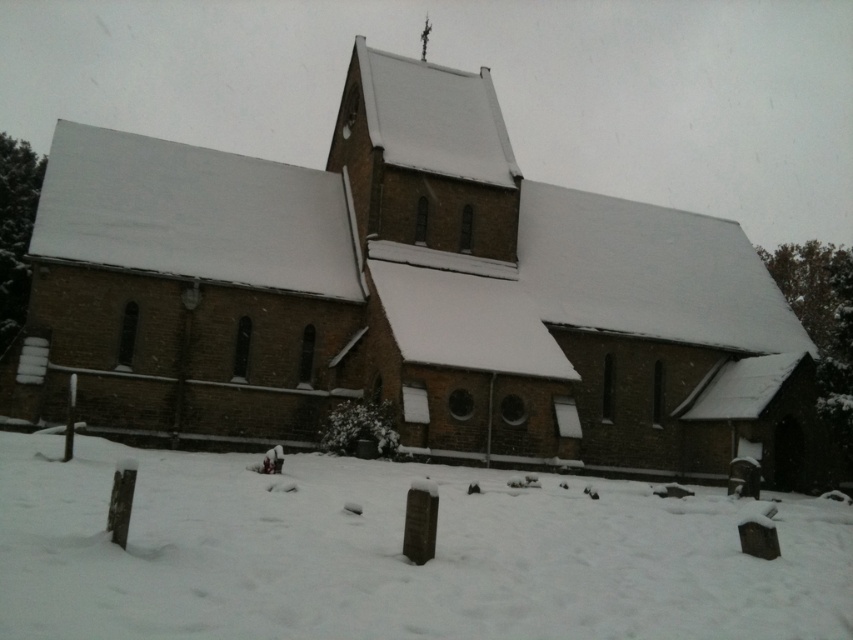
Question: Where is brown brick church at center located in relation to white powdery snow at lower center in the image?

Choices:
 (A) left
 (B) right

Answer: (A)

Question: Which object appears closest to the camera in this image?

Choices:
 (A) white powdery snow at lower center
 (B) brown brick church at center

Answer: (A)

Question: Among these points, which one is farthest from the camera?

Choices:
 (A) (154, 467)
 (B) (675, 316)

Answer: (B)

Question: From the image, what is the correct spatial relationship of brown brick church at center in relation to white powdery snow at lower center?

Choices:
 (A) below
 (B) above

Answer: (B)

Question: Is brown brick church at center smaller than white powdery snow at lower center?

Choices:
 (A) yes
 (B) no

Answer: (B)